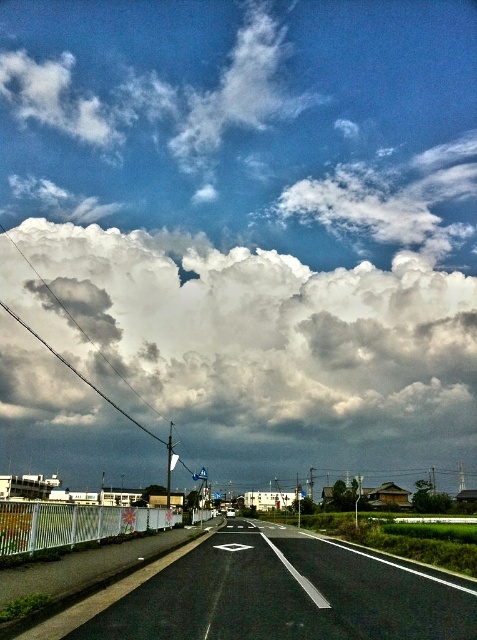
Question: Which of the following is the closest to the observer?

Choices:
 (A) black asphalt highway at center
 (B) white fluffy cloud at upper center

Answer: (A)

Question: Does white fluffy cloud at upper center have a greater width compared to black asphalt highway at center?

Choices:
 (A) no
 (B) yes

Answer: (B)

Question: Which object appears farthest from the camera in this image?

Choices:
 (A) white fluffy cloud at upper center
 (B) black asphalt highway at center

Answer: (A)

Question: Can you confirm if white fluffy cloud at upper center is positioned to the right of black asphalt highway at center?

Choices:
 (A) yes
 (B) no

Answer: (B)

Question: Can you confirm if white fluffy cloud at upper center is wider than black asphalt highway at center?

Choices:
 (A) no
 (B) yes

Answer: (B)

Question: Which point is closer to the camera?

Choices:
 (A) white fluffy cloud at upper center
 (B) black asphalt highway at center

Answer: (B)